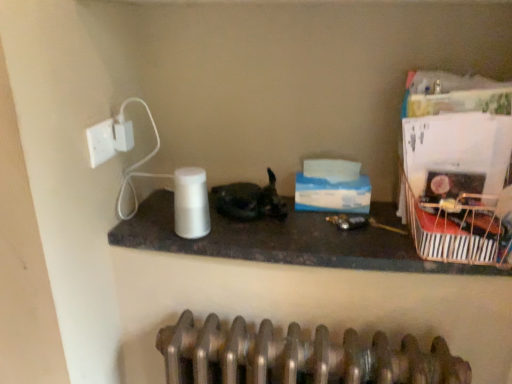
Question: Should I look upward or downward to see white matte paper towel at center?

Choices:
 (A) down
 (B) up

Answer: (A)

Question: Is white plastic electric outlet at upper left smaller than metallic striped basket at right?

Choices:
 (A) yes
 (B) no

Answer: (A)

Question: Is white plastic electric outlet at upper left turned away from metallic striped basket at right?

Choices:
 (A) yes
 (B) no

Answer: (B)

Question: Does white plastic electric outlet at upper left have a greater width compared to metallic striped basket at right?

Choices:
 (A) yes
 (B) no

Answer: (B)

Question: From a real-world perspective, is white plastic electric outlet at upper left located beneath metallic striped basket at right?

Choices:
 (A) no
 (B) yes

Answer: (A)

Question: Is white plastic electric outlet at upper left directly adjacent to metallic striped basket at right?

Choices:
 (A) no
 (B) yes

Answer: (A)

Question: Is white plastic electric outlet at upper left thinner than metallic striped basket at right?

Choices:
 (A) yes
 (B) no

Answer: (A)

Question: Does white plastic socket at upper left have a greater height compared to shiny black cat at center?

Choices:
 (A) no
 (B) yes

Answer: (A)

Question: Is white plastic socket at upper left directly adjacent to shiny black cat at center?

Choices:
 (A) yes
 (B) no

Answer: (B)

Question: Is white plastic socket at upper left surrounding shiny black cat at center?

Choices:
 (A) no
 (B) yes

Answer: (A)

Question: From a real-world perspective, is white plastic socket at upper left over shiny black cat at center?

Choices:
 (A) yes
 (B) no

Answer: (A)

Question: From the image's perspective, would you say white plastic socket at upper left is positioned over shiny black cat at center?

Choices:
 (A) yes
 (B) no

Answer: (A)

Question: From a real-world perspective, is white plastic socket at upper left positioned under shiny black cat at center based on gravity?

Choices:
 (A) yes
 (B) no

Answer: (B)

Question: Does white plastic socket at upper left appear on the right side of metallic striped basket at right?

Choices:
 (A) yes
 (B) no

Answer: (B)